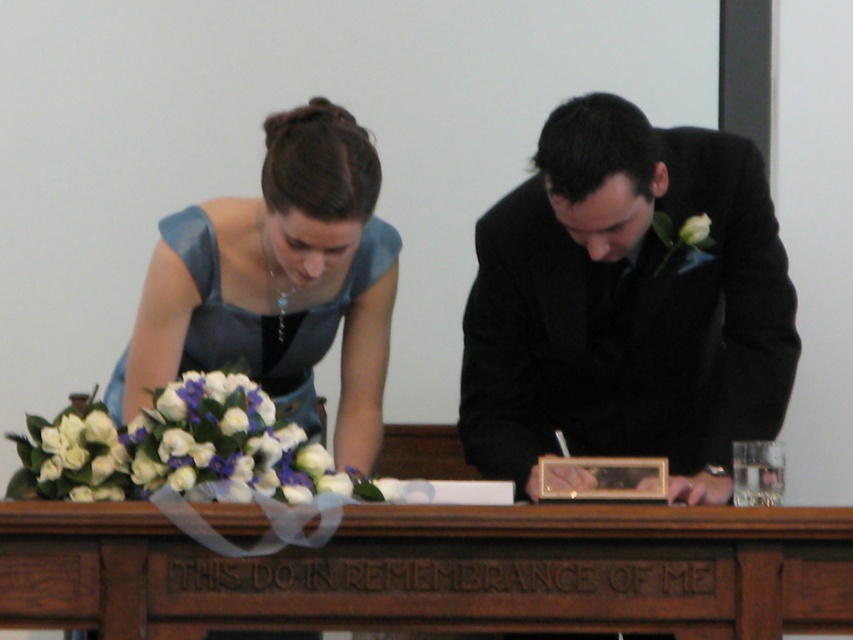
You are a photographer at the event and want to ensure both white matte flowers are visible in the photo. Since the white matte flowers at center is bigger than the white matte flower at right, which one should you focus on to capture both clearly?

To ensure both the white matte flowers at center and the white matte flower at right are visible, focus on the larger white matte flowers at center, as it will be easier to capture both by centering the composition around it while still including the smaller one at the right.

You are a photographer standing at the camera position. You need to capture a closeup shot of the matte blue dress at center. Given that your camera can focus on objects within 2 meters, will you be able to take the closeup?

The matte blue dress at center is 2.78 meters away from the camera. Since the camera can only focus on objects within 2 meters, you will not be able to take a closeup shot of the matte blue dress at center.